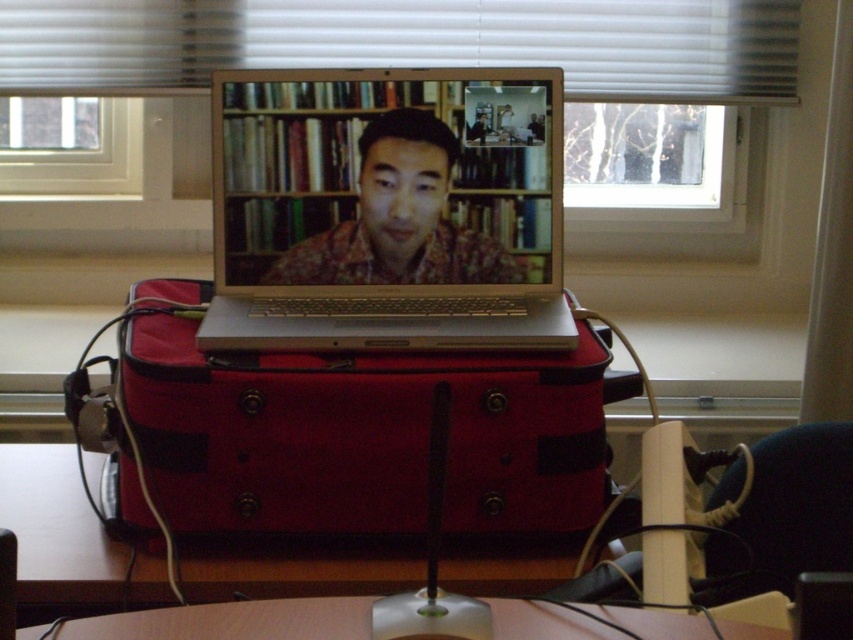
You are setting up a video call in this workspace. You need to place a 15 cm wide laptop stand between the red fabric suitcase at center and the white blinds at upper center. Can the space between them accommodate the stand?

The red fabric suitcase at center has a lesser width compared to white blinds at upper center. Since the laptop stand is 15 cm wide, the space between them can accommodate the stand as the distance between the two objects is sufficient.

You are setting up a video call and need to adjust the lighting. The room has a red fabric suitcase at center and a transparent glass window at upper left. Which object can you move to improve the lighting for your video call?

The transparent glass window at upper left can be adjusted to improve lighting since it is positioned above the red fabric suitcase at center and allows natural light in.